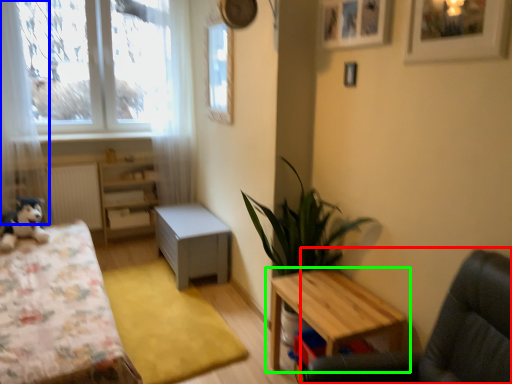
Question: Which object is positioned closest to swivel chair (highlighted by a red box)? Select from curtain (highlighted by a blue box) and table (highlighted by a green box).

Choices:
 (A) curtain
 (B) table

Answer: (B)